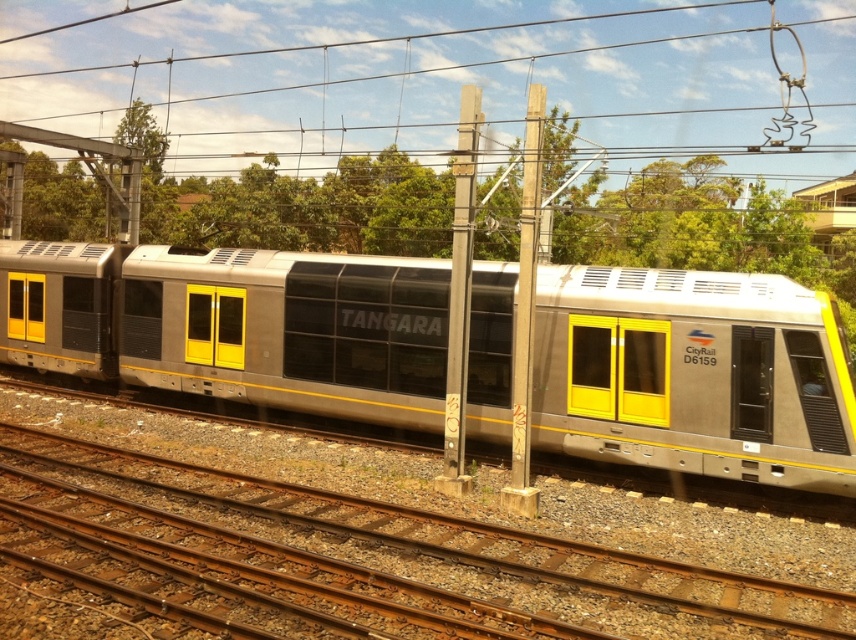
From the picture: Is metallic wire at upper center positioned before smooth wood pole at center?

No, it is behind smooth wood pole at center.

Between metallic wire at upper center and smooth wood pole at center, which one is positioned lower?

smooth wood pole at center is below.

Describe the element at coordinates (400, 74) in the screenshot. This screenshot has width=856, height=640. I see `metallic wire at upper center` at that location.

Find the location of a particular element. This screenshot has height=640, width=856. metallic wire at upper center is located at coordinates point(400,74).

Which is more to the right, matte silver train car at left or smooth wood pole at center?

smooth wood pole at center

Measure the distance between matte silver train car at left and camera.

They are 60.99 feet apart.

Identify the location of matte silver train car at left. This screenshot has height=640, width=856. (60, 305).

Does metallic silver train at center have a smaller size compared to metallic gray pole at center?

Incorrect, metallic silver train at center is not smaller in size than metallic gray pole at center.

Does metallic silver train at center have a greater height compared to metallic gray pole at center?

In fact, metallic silver train at center may be shorter than metallic gray pole at center.

Where is `metallic silver train at center`? This screenshot has width=856, height=640. metallic silver train at center is located at coordinates (235, 324).